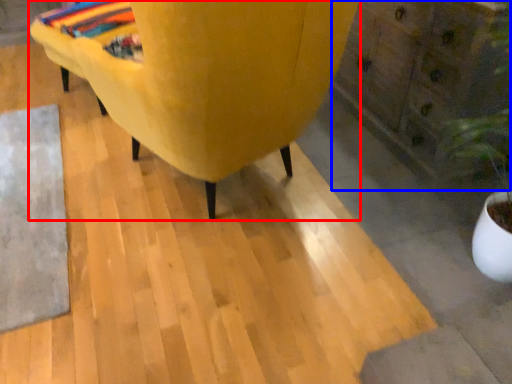
Question: Which of the following is the farthest to the observer, furniture (highlighted by a red box) or dresser (highlighted by a blue box)?

Choices:
 (A) furniture
 (B) dresser

Answer: (B)